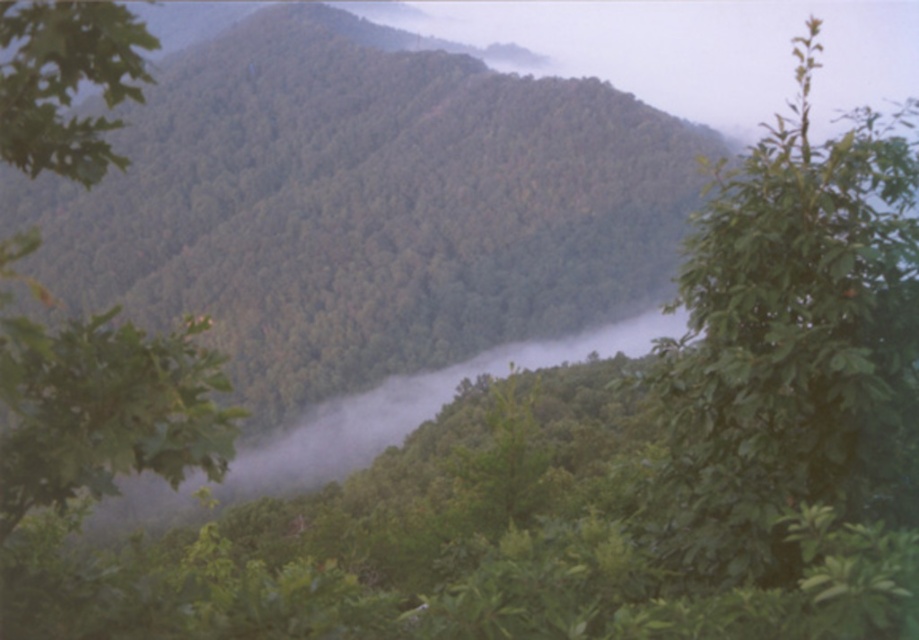
Does point (744, 472) come behind point (105, 122)?

Yes, it is.

Which is above, green leafy tree at right or green leafy tree at upper left?

green leafy tree at right

The width and height of the screenshot is (919, 640). Identify the location of green leafy tree at right. (792, 346).